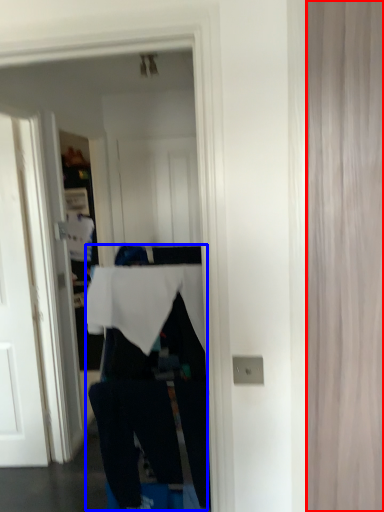
Question: Which object is closer to the camera taking this photo, curtain (highlighted by a red box) or person (highlighted by a blue box)?

Choices:
 (A) curtain
 (B) person

Answer: (A)